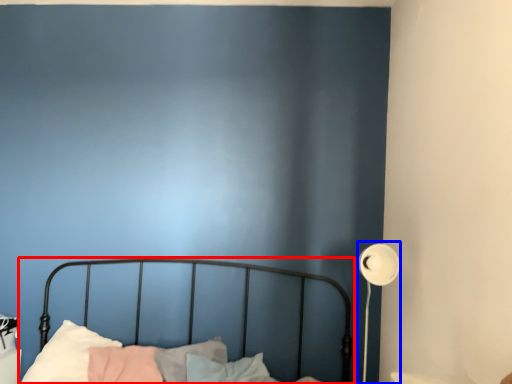
Question: Which of the following is the closest to the observer, bed (highlighted by a red box) or lamp (highlighted by a blue box)?

Choices:
 (A) bed
 (B) lamp

Answer: (A)